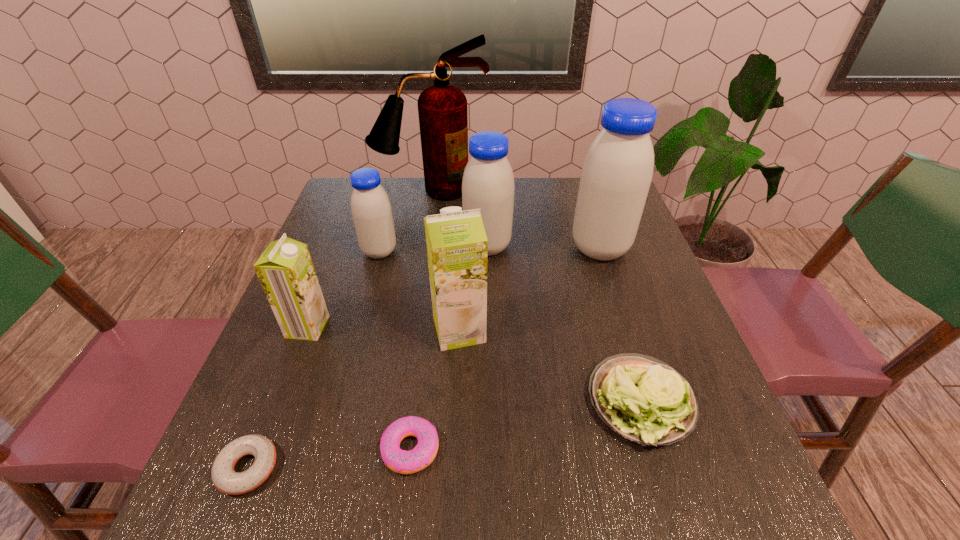
This screenshot has height=540, width=960. I want to click on free point between the left doughnut and the smallest blue soya milk, so click(314, 360).

Locate an element on the screen. Image resolution: width=960 pixels, height=540 pixels. vacant area between the green lettuce and the left doughnut is located at coordinates (444, 435).

Where is `vacant area between the pink doughnut and the bigger green soya milk`? vacant area between the pink doughnut and the bigger green soya milk is located at coordinates pos(435,389).

Locate an element on the screen. object that is the fifth closest one to the right doughnut is located at coordinates coord(371,210).

This screenshot has height=540, width=960. Find the location of `object that is the fourth nearest to the left doughnut`. object that is the fourth nearest to the left doughnut is located at coordinates (371, 210).

Where is `the second closest soya milk to the leftmost blue soya milk`? The height and width of the screenshot is (540, 960). the second closest soya milk to the leftmost blue soya milk is located at coordinates (285, 269).

Locate an element on the screen. This screenshot has height=540, width=960. the third closest soya milk relative to the rightmost blue soya milk is located at coordinates (371, 210).

Point out which blue soya milk is positioned as the nearest to the bigger green soya milk. Please provide its 2D coordinates. Your answer should be formatted as a tuple, i.e. [(x, y)], where the tuple contains the x and y coordinates of a point satisfying the conditions above.

[(488, 184)]

Identify which blue soya milk is the nearest to the left doughnut. Please provide its 2D coordinates. Your answer should be formatted as a tuple, i.e. [(x, y)], where the tuple contains the x and y coordinates of a point satisfying the conditions above.

[(371, 210)]

Locate an element on the screen. This screenshot has height=540, width=960. free space that satisfies the following two spatial constraints: 1. on the back side of the rightmost soya milk; 2. on the right side of the smallest blue soya milk is located at coordinates tap(380, 248).